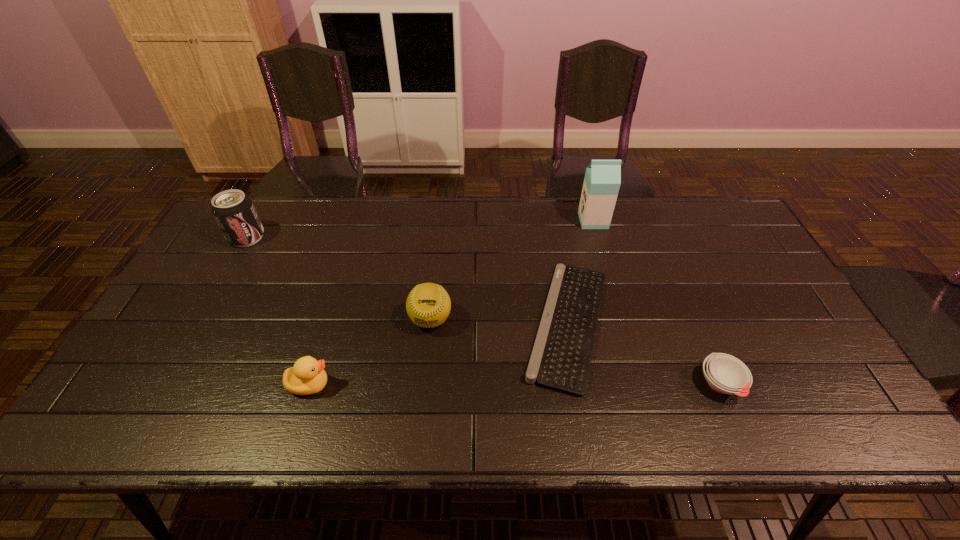
Identify the location of free location located on the right of the tallest object. Image resolution: width=960 pixels, height=540 pixels. (621, 221).

Locate an element on the screen. The width and height of the screenshot is (960, 540). free space located on the left of the leftmost object is located at coordinates (214, 237).

Image resolution: width=960 pixels, height=540 pixels. I want to click on blank space located on the logo side of the softball, so click(x=419, y=433).

Find the location of `vacant space situated 0.230m at the beak of the duck`. vacant space situated 0.230m at the beak of the duck is located at coordinates (428, 384).

Where is `vacant space located 0.180m on the back of the soup bowl`? vacant space located 0.180m on the back of the soup bowl is located at coordinates (688, 308).

I want to click on vacant space situated on the right of the computer keyboard, so click(691, 324).

This screenshot has height=540, width=960. Identify the location of milk carton at the far edge. (602, 181).

Find the location of `soda can that is positioned at the far edge`. soda can that is positioned at the far edge is located at coordinates (234, 212).

You are a GUI agent. You are given a task and a screenshot of the screen. Output one action in this format:
    pyautogui.click(x=<x>, y=<y>)
    Task: Click on the object present at the near edge
    This screenshot has height=540, width=960.
    Given the screenshot: What is the action you would take?
    pyautogui.click(x=725, y=374)

Where is `object located at the left edge`? object located at the left edge is located at coordinates (234, 212).